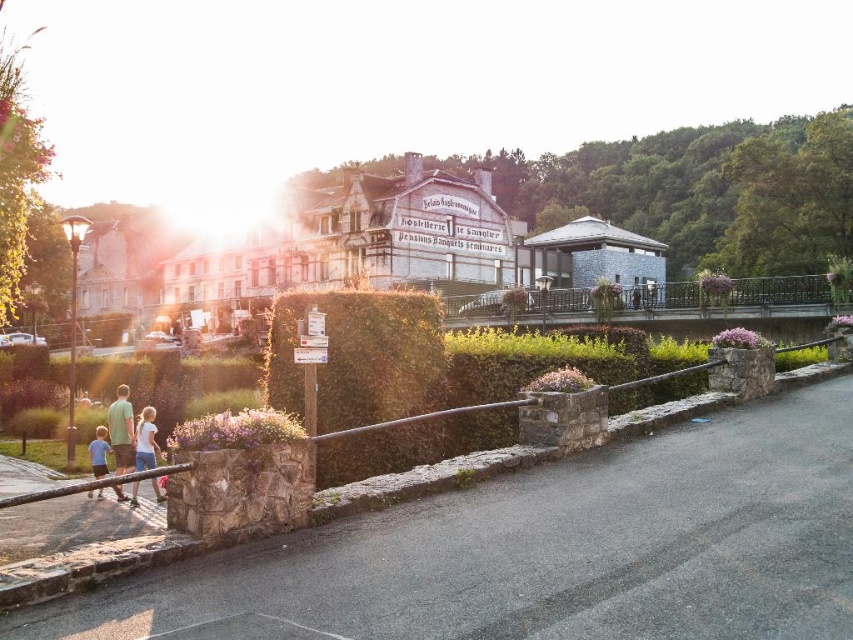
Question: Does white cotton shirt at lower left appear under blue cotton shirt at lower left?

Choices:
 (A) no
 (B) yes

Answer: (A)

Question: Which of the following is the farthest from the observer?

Choices:
 (A) white wooden hotel at center
 (B) light green fabric shirt at lower left

Answer: (A)

Question: Which of these objects is positioned closest to the light green fabric shirt at lower left?

Choices:
 (A) blue cotton shirt at lower left
 (B) white cotton shirt at lower left
 (C) green leafy hedge at center

Answer: (B)

Question: Which object is closer to the camera taking this photo?

Choices:
 (A) white cotton shirt at lower left
 (B) gray stone building at center

Answer: (A)

Question: Can you confirm if light green fabric shirt at lower left is positioned to the left of blue cotton shirt at lower left?

Choices:
 (A) yes
 (B) no

Answer: (A)

Question: Is light green fabric shirt at lower left thinner than blue cotton shirt at lower left?

Choices:
 (A) yes
 (B) no

Answer: (B)